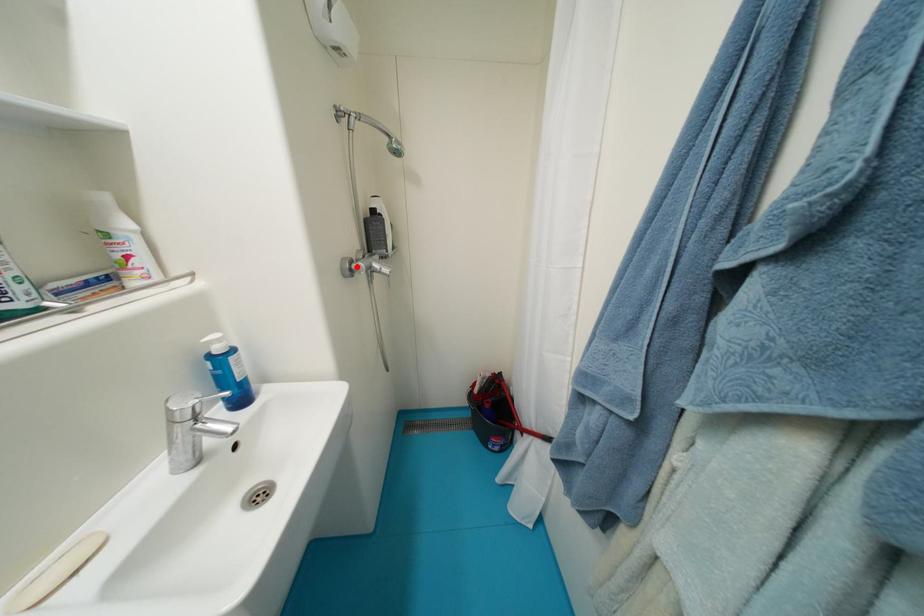
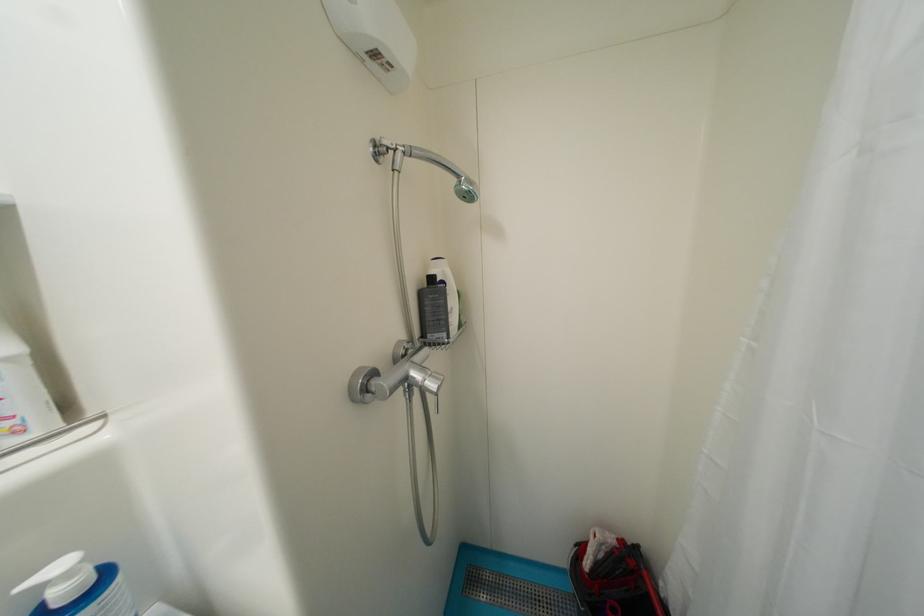
The point at the highlighted location is marked in the first image. Where is the corresponding point in the second image?

(374, 383)